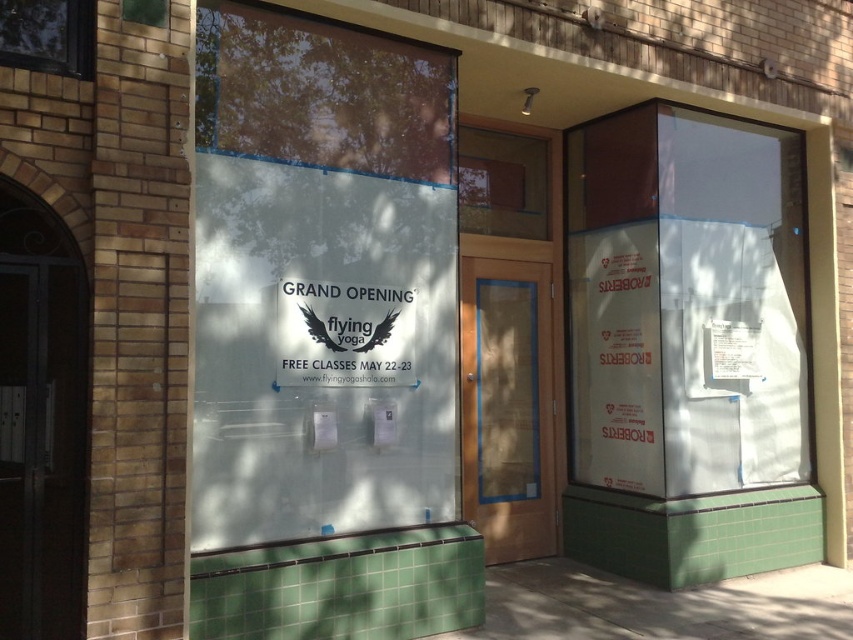
Question: Which object is farther from the camera taking this photo?

Choices:
 (A) clear glass door at center
 (B) dark wood door at left

Answer: (A)

Question: Which object is closer to the camera taking this photo?

Choices:
 (A) dark wood door at left
 (B) transparent glass sign at center
 (C) clear glass window at upper left

Answer: (A)

Question: Does transparent glass sign at center appear under clear glass door at center?

Choices:
 (A) no
 (B) yes

Answer: (A)

Question: Does white paper sign at center appear over clear glass window at upper left?

Choices:
 (A) no
 (B) yes

Answer: (A)

Question: Which of the following is the farthest from the observer?

Choices:
 (A) (49, 512)
 (B) (45, 1)
 (C) (494, 524)

Answer: (C)

Question: Where is clear glass door at center located in relation to clear glass window at upper left in the image?

Choices:
 (A) left
 (B) right

Answer: (B)